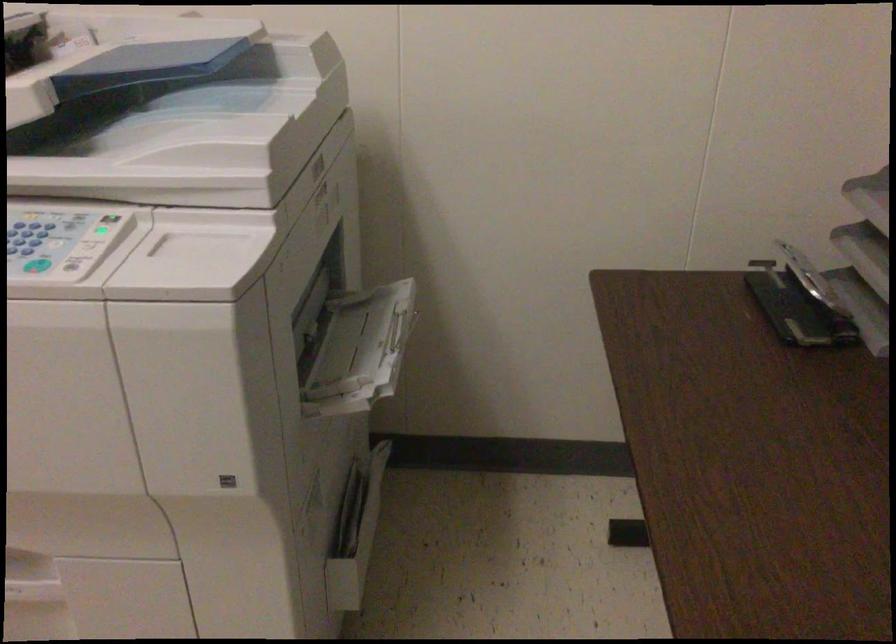
Locate an element on the screen. blue printer button is located at coordinates (37, 265).